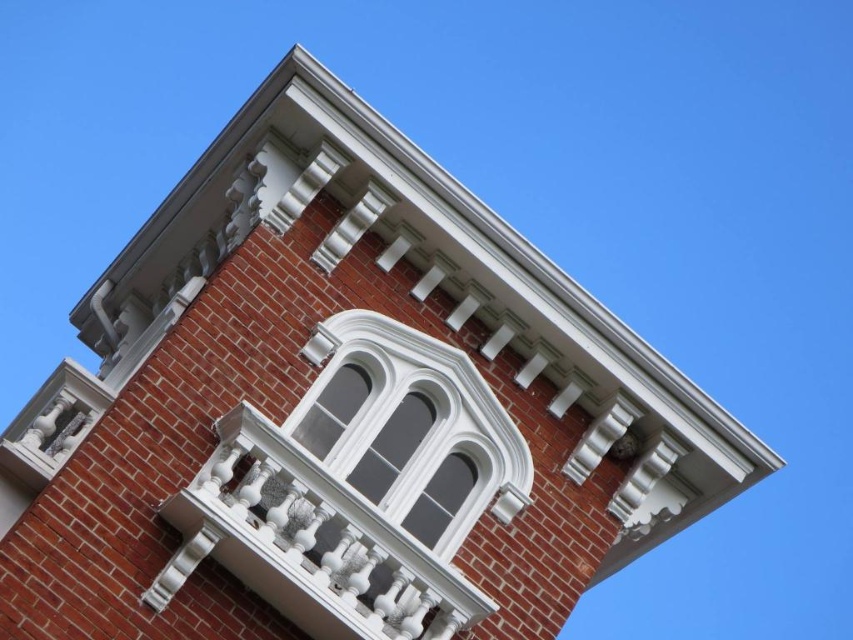
Does point (318, 384) lie in front of point (334, 406)?

Yes.

Find the location of a particular element. white glossy window at center is located at coordinates (410, 428).

Does white textured balcony at upper center have a larger size compared to white glossy window at center?

No.

In the scene shown: Measure the distance between point (367,508) and camera.

Point (367,508) and camera are 39.28 meters apart from each other.

Locate an element on the screen. white textured balcony at upper center is located at coordinates (309, 544).

Is point (305, 496) less distant than point (335, 397)?

Yes, point (305, 496) is in front of point (335, 397).

Which is behind, point (431, 632) or point (351, 406)?

The point (351, 406) is more distant.

This screenshot has width=853, height=640. What are the coordinates of `white textured balcony at upper center` in the screenshot? It's located at click(x=309, y=544).